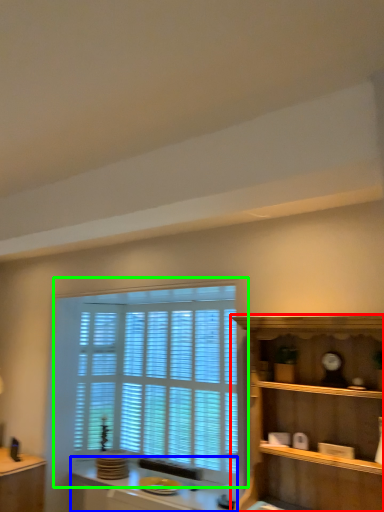
Question: Which object is positioned closest to shelf (highlighted by a red box)? Select from vanity (highlighted by a blue box) and window (highlighted by a green box).

Choices:
 (A) vanity
 (B) window

Answer: (B)